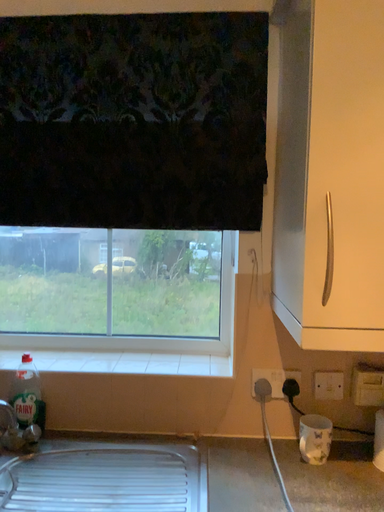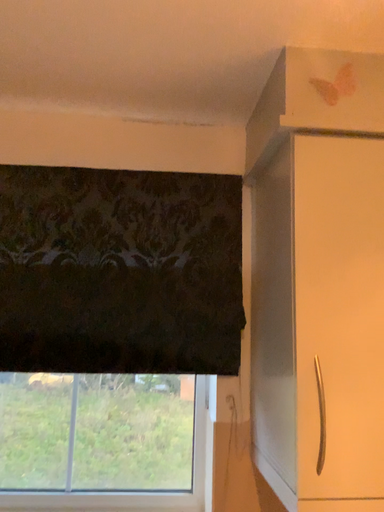
Question: How did the camera likely rotate when shooting the video?

Choices:
 (A) rotated downward
 (B) rotated upward

Answer: (B)